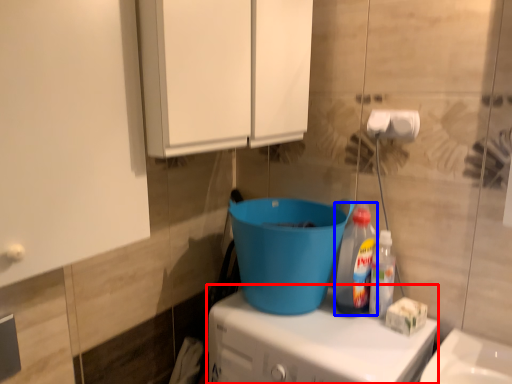
Question: Which of the following is the farthest to the observer, appliance (highlighted by a red box) or bottle (highlighted by a blue box)?

Choices:
 (A) appliance
 (B) bottle

Answer: (B)